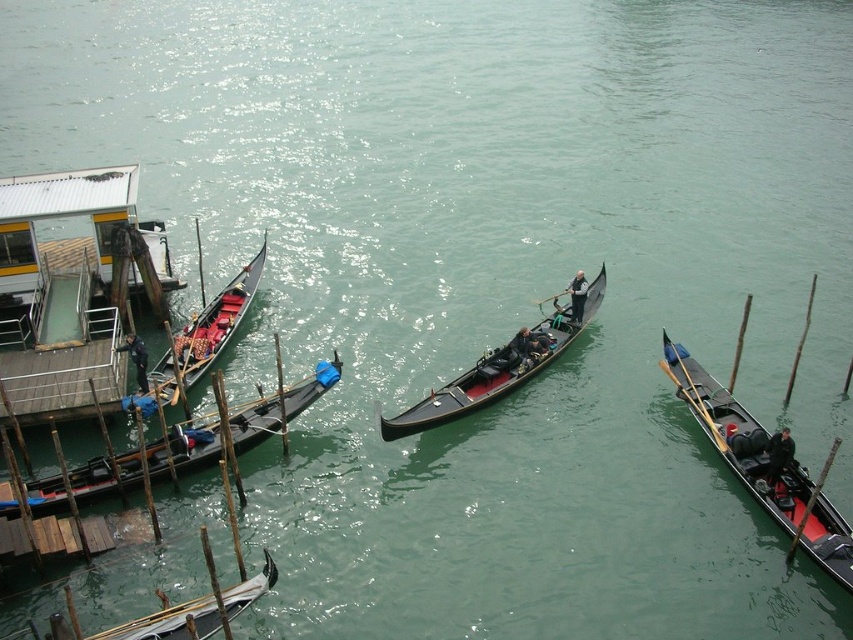
Question: Which object appears farthest from the camera in this image?

Choices:
 (A) black polished gondola at center
 (B) dark blue leather jacket at lower right

Answer: (A)

Question: Which point is closer to the camera taking this photo?

Choices:
 (A) (572, 291)
 (B) (782, 440)

Answer: (B)

Question: Based on their relative distances, which object is nearer to the dark brown wooden paddle at center?

Choices:
 (A) black wood paddle at center
 (B) wooden gondola at left
 (C) wooden gondola at center
 (D) dark blue fabric jacket at left

Answer: (A)

Question: Is wooden gondola at left wider than dark brown wooden paddle at center?

Choices:
 (A) yes
 (B) no

Answer: (A)

Question: Can you confirm if black polished gondola at right is positioned to the right of wooden gondola at left?

Choices:
 (A) yes
 (B) no

Answer: (A)

Question: Is dark blue fabric jacket at left smaller than wooden paddle at right?

Choices:
 (A) no
 (B) yes

Answer: (B)